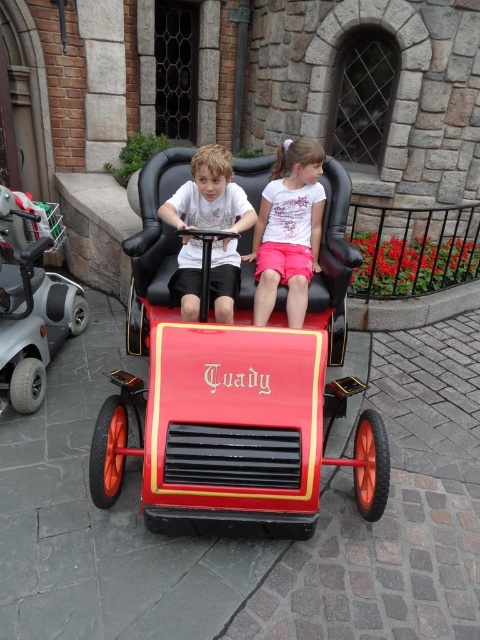
Question: Which point is farther from the camera taking this photo?

Choices:
 (A) [x=308, y=204]
 (B) [x=317, y=218]

Answer: (B)

Question: Which object is farther from the camera taking this photo?

Choices:
 (A) matte white shirt at center
 (B) shiny red toy car at center
 (C) pink cotton shorts at center
 (D) metallic silver scooter at lower left

Answer: (C)

Question: Does metallic silver scooter at lower left appear on the right side of matte white shirt at center?

Choices:
 (A) yes
 (B) no

Answer: (B)

Question: Is shiny red toy car at center thinner than pink cotton shorts at center?

Choices:
 (A) yes
 (B) no

Answer: (B)

Question: Considering the real-world distances, which object is closest to the matte white shirt at center?

Choices:
 (A) pink cotton shorts at center
 (B) shiny red toy car at center
 (C) metallic silver scooter at lower left

Answer: (B)

Question: In this image, where is metallic silver scooter at lower left located relative to matte white shirt at center?

Choices:
 (A) right
 (B) left

Answer: (B)